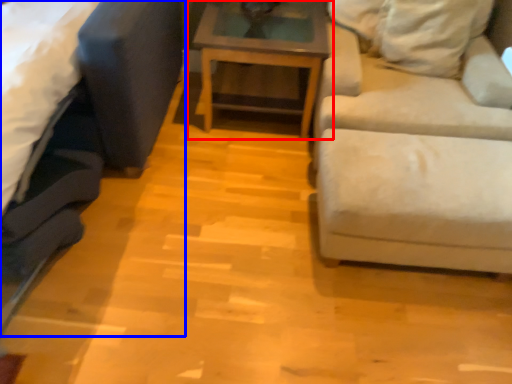
Question: Which point is closer to the camera, table (highlighted by a red box) or studio couch (highlighted by a blue box)?

Choices:
 (A) table
 (B) studio couch

Answer: (B)